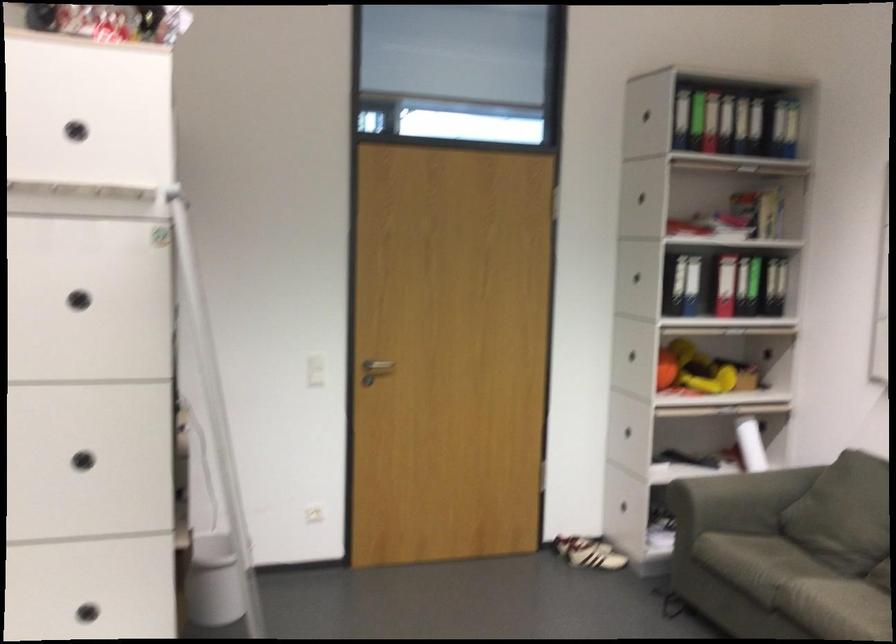
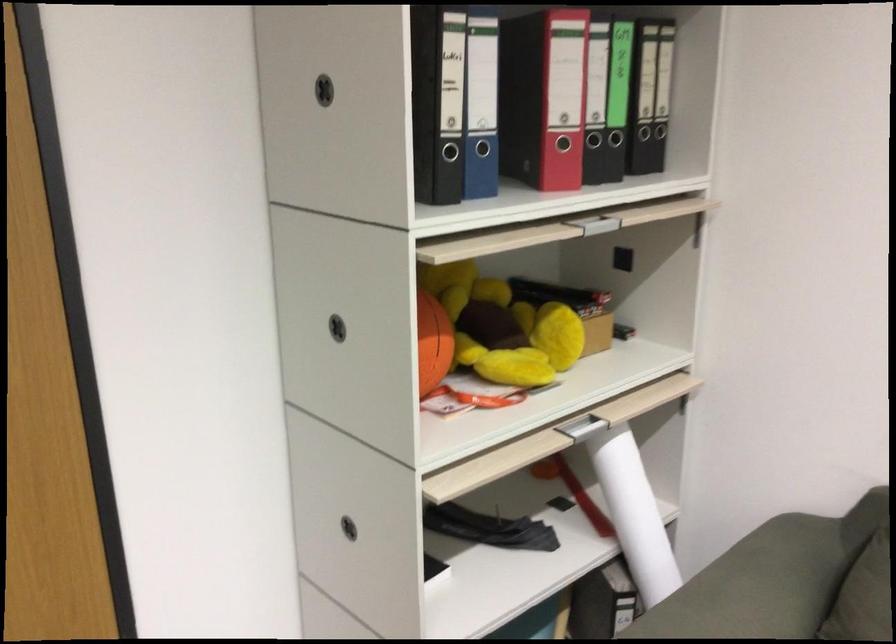
Locate, in the second image, the point that corresponds to point (725, 317) in the first image.

(573, 219)